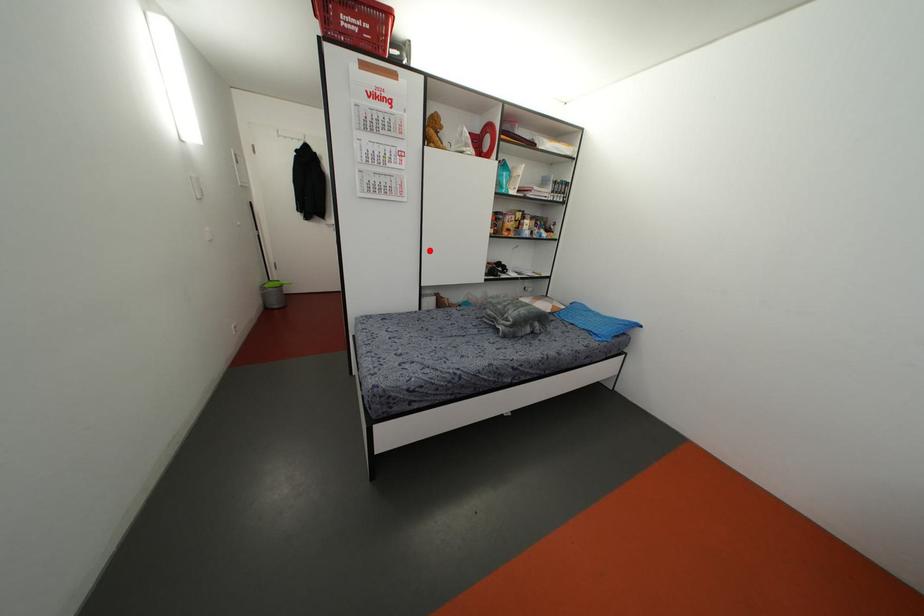
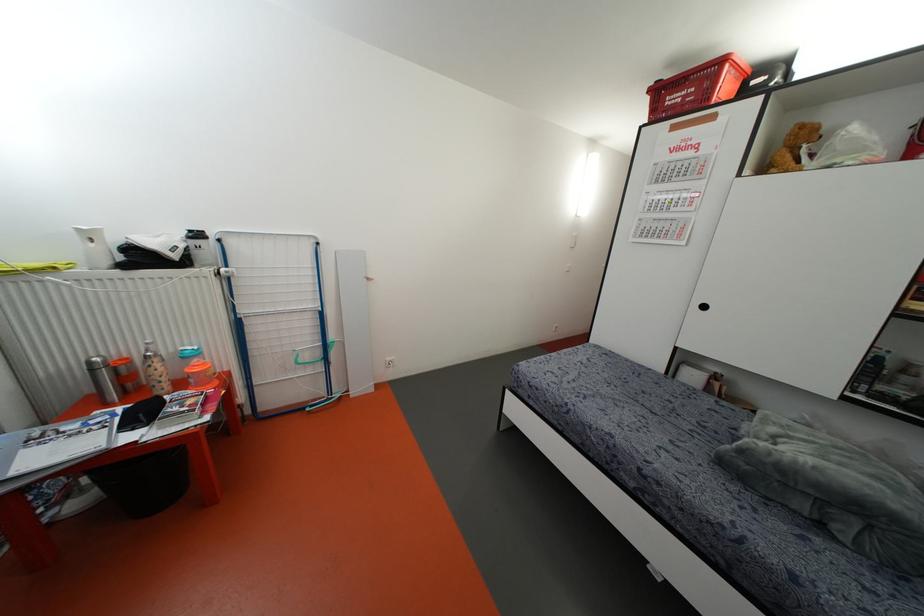
Where in the second image is the point corresponding to the highlighted location from the first image?

(703, 307)